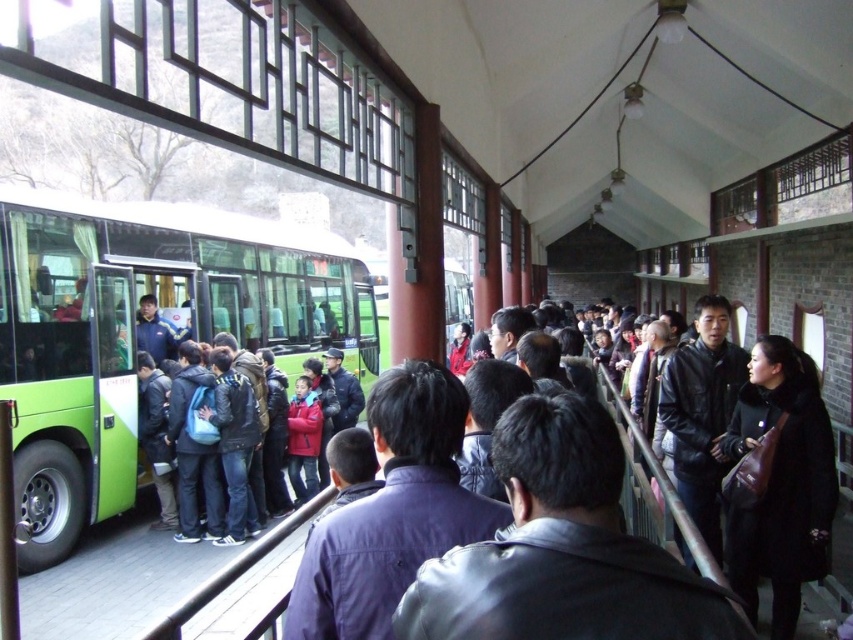
You are a maintenance worker who needs to check the height of the green matte bus at left to ensure it can pass under a low bridge. You also see a dark blue leather jacket at center. Which object is taller?

The green matte bus at left is much taller than the dark blue leather jacket at center, so the bus is taller.

You are standing at the bus station and see two points marked in the scene. The first point is at coordinates point (352,252) and the second point is at point (602,632). Which point is closer to the green bus parked on the left side?

Point (352,252) is behind point (602,632). Therefore, point (602,632) is closer to the green bus parked on the left side.

You are a passenger waiting to board the bus and you see the green matte bus at left and the dark blue leather jacket at center. Which object is closer to the entrance of the bus?

The green matte bus at left is positioned on the left side of dark blue leather jacket at center, so the dark blue leather jacket at center is closer to the entrance of the bus.